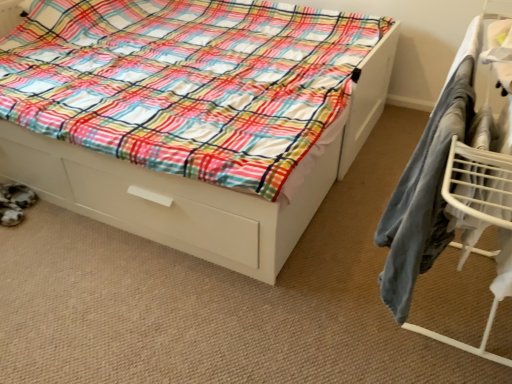
Locate an element on the screen. Image resolution: width=512 pixels, height=384 pixels. metal drying rack at right is located at coordinates (480, 212).

Image resolution: width=512 pixels, height=384 pixels. What do you see at coordinates (480, 212) in the screenshot? I see `metal drying rack at right` at bounding box center [480, 212].

Image resolution: width=512 pixels, height=384 pixels. Find the location of `white glossy bed at center`. white glossy bed at center is located at coordinates (198, 187).

Image resolution: width=512 pixels, height=384 pixels. Describe the element at coordinates (198, 187) in the screenshot. I see `white glossy bed at center` at that location.

You are a GUI agent. You are given a task and a screenshot of the screen. Output one action in this format:
    pyautogui.click(x=<x>, y=<y>)
    Task: Click on the metal drying rack at right
    Image resolution: width=512 pixels, height=384 pixels.
    Given the screenshot: What is the action you would take?
    tap(480, 212)

In the image, is white glossy bed at center on the left side or the right side of metal drying rack at right?

Clearly, white glossy bed at center is on the left of metal drying rack at right in the image.

Is white glossy bed at center behind metal drying rack at right?

Yes, it is.

Is point (112, 200) closer or farther from the camera than point (480, 169)?

Point (112, 200) is positioned farther from the camera compared to point (480, 169).

From the image's perspective, is white glossy bed at center located beneath metal drying rack at right?

Incorrect, from the image's perspective, white glossy bed at center is higher than metal drying rack at right.

From a real-world perspective, which is physically above, white glossy bed at center or metal drying rack at right?

metal drying rack at right.

In terms of width, does white glossy bed at center look wider or thinner when compared to metal drying rack at right?

In the image, white glossy bed at center appears to be wider than metal drying rack at right.

Which of these two, white glossy bed at center or metal drying rack at right, stands taller?

metal drying rack at right.

Considering the sizes of objects white glossy bed at center and metal drying rack at right in the image provided, who is smaller, white glossy bed at center or metal drying rack at right?

Smaller between the two is metal drying rack at right.

Could metal drying rack at right be considered to be inside white glossy bed at center?

No.

Is white glossy bed at center placed right next to metal drying rack at right?

No, white glossy bed at center is not touching metal drying rack at right.

Is metal drying rack at right at the back of white glossy bed at center?

No, metal drying rack at right is not at the back of white glossy bed at center.

How many degrees apart are the facing directions of white glossy bed at center and metal drying rack at right?

The angular difference between white glossy bed at center and metal drying rack at right is 89.1 degrees.

I want to click on furniture in front of the white glossy bed at center, so click(480, 212).

Would you say metal drying rack at right is to the left or to the right of white glossy bed at center in the picture?

From the image, it's evident that metal drying rack at right is to the right of white glossy bed at center.

Based on the photo, considering their positions, is metal drying rack at right located in front of or behind white glossy bed at center?

metal drying rack at right is in front of white glossy bed at center.

Is point (458, 141) closer or farther from the camera than point (285, 224)?

Point (458, 141) is closer to the camera than point (285, 224).

From the image's perspective, which one is positioned lower, metal drying rack at right or white glossy bed at center?

metal drying rack at right appears lower in the image.

From a real-world perspective, is metal drying rack at right on top of white glossy bed at center?

Yes, from a real-world perspective, metal drying rack at right is over white glossy bed at center

Looking at this image, which object is wider, metal drying rack at right or white glossy bed at center?

white glossy bed at center is wider.

Is metal drying rack at right taller or shorter than white glossy bed at center?

In the image, metal drying rack at right appears to be taller than white glossy bed at center.

Considering the sizes of objects metal drying rack at right and white glossy bed at center in the image provided, who is bigger, metal drying rack at right or white glossy bed at center?

white glossy bed at center.

Can white glossy bed at center be found inside metal drying rack at right?

No, white glossy bed at center is located outside of metal drying rack at right.

Are metal drying rack at right and white glossy bed at center far apart?

No, there isn't a large distance between metal drying rack at right and white glossy bed at center.

Is metal drying rack at right looking in the opposite direction of white glossy bed at center?

No, metal drying rack at right's orientation is not away from white glossy bed at center.

How different are the orientations of metal drying rack at right and white glossy bed at center in degrees?

The angle between the facing direction of metal drying rack at right and the facing direction of white glossy bed at center is 89.1 degrees.

This screenshot has width=512, height=384. I want to click on furniture that is in front of the white glossy bed at center, so click(x=480, y=212).

The height and width of the screenshot is (384, 512). Identify the location of bed lying behind the metal drying rack at right. (198, 187).

What are the coordinates of `furniture below the white glossy bed at center (from the image's perspective)` in the screenshot? It's located at (480, 212).